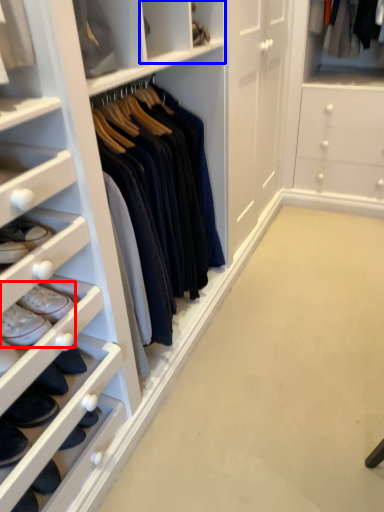
Question: Which object is further to the camera taking this photo, footwear (highlighted by a red box) or cabinet (highlighted by a blue box)?

Choices:
 (A) footwear
 (B) cabinet

Answer: (B)